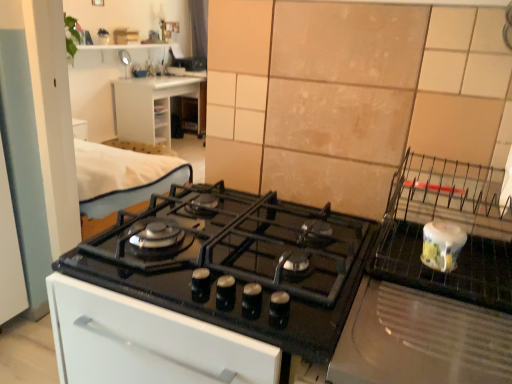
Question: From the image's perspective, is white plastic drawer at upper left on black glass gas stove at center?

Choices:
 (A) yes
 (B) no

Answer: (A)

Question: Are white plastic drawer at upper left and black glass gas stove at center far apart?

Choices:
 (A) yes
 (B) no

Answer: (A)

Question: Is white plastic drawer at upper left turned away from black glass gas stove at center?

Choices:
 (A) yes
 (B) no

Answer: (B)

Question: Considering the relative positions of white plastic drawer at upper left and black glass gas stove at center in the image provided, is white plastic drawer at upper left to the right of black glass gas stove at center from the viewer's perspective?

Choices:
 (A) no
 (B) yes

Answer: (A)

Question: From a real-world perspective, is white plastic drawer at upper left below black glass gas stove at center?

Choices:
 (A) yes
 (B) no

Answer: (A)

Question: Does white plastic drawer at upper left lie behind black glass gas stove at center?

Choices:
 (A) yes
 (B) no

Answer: (A)

Question: From the image's perspective, is black glass gas stove at center below beige tile at upper right?

Choices:
 (A) no
 (B) yes

Answer: (B)

Question: Is black glass gas stove at center directly adjacent to beige tile at upper right?

Choices:
 (A) yes
 (B) no

Answer: (B)

Question: Can you confirm if black glass gas stove at center is thinner than beige tile at upper right?

Choices:
 (A) no
 (B) yes

Answer: (A)

Question: From the image's perspective, is black glass gas stove at center above beige tile at upper right?

Choices:
 (A) yes
 (B) no

Answer: (B)

Question: Is black glass gas stove at center at the left side of beige tile at upper right?

Choices:
 (A) no
 (B) yes

Answer: (B)

Question: Does black glass gas stove at center have a greater height compared to beige tile at upper right?

Choices:
 (A) no
 (B) yes

Answer: (A)

Question: Does beige tile at upper right appear on the left side of white ceramic jar at right?

Choices:
 (A) yes
 (B) no

Answer: (B)